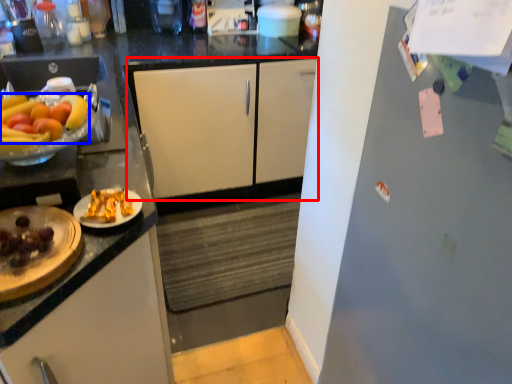
Question: Which object is closer to the camera taking this photo, cabinetry (highlighted by a red box) or grapefruit (highlighted by a blue box)?

Choices:
 (A) cabinetry
 (B) grapefruit

Answer: (B)